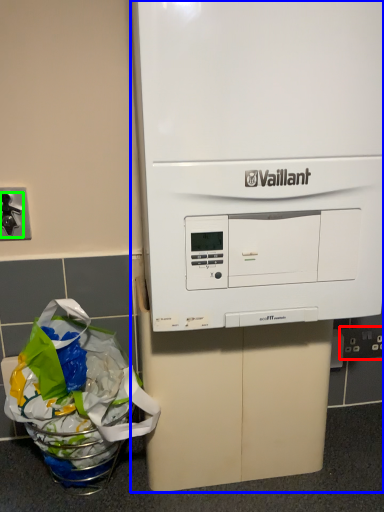
Question: Estimate the real-world distances between objects in this image. Which object is closer to electric outlet (highlighted by a red box), home appliance (highlighted by a blue box) or faucet (highlighted by a green box)?

Choices:
 (A) home appliance
 (B) faucet

Answer: (A)